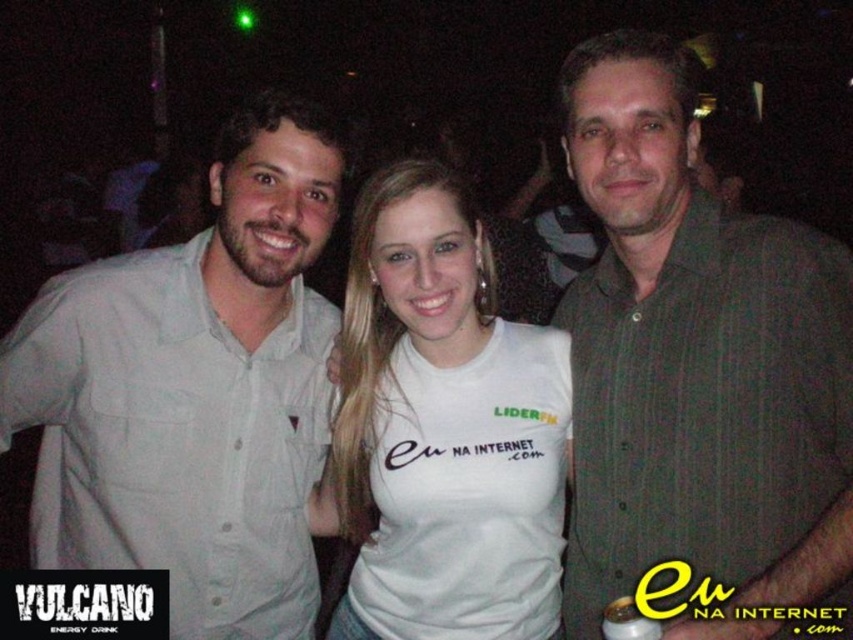
Can you confirm if dark green striped shirt at center is positioned below white cotton t-shirt at center?

Actually, dark green striped shirt at center is above white cotton t-shirt at center.

Does point (618, 589) come closer to viewer compared to point (480, 339)?

Yes, point (618, 589) is in front of point (480, 339).

Is point (685, 360) positioned before point (372, 412)?

Yes, it is.

Find the location of a particular element. This screenshot has width=853, height=640. dark green striped shirt at center is located at coordinates (695, 360).

Between dark green striped shirt at center and light gray button-up shirt at left, which one is positioned lower?

light gray button-up shirt at left

Between point (619, 465) and point (186, 508), which one is positioned in front?

Point (186, 508) is in front.

Describe the element at coordinates (695, 360) in the screenshot. I see `dark green striped shirt at center` at that location.

The image size is (853, 640). In order to click on dark green striped shirt at center in this screenshot , I will do click(695, 360).

Is light gray button-up shirt at left below white cotton t-shirt at center?

Actually, light gray button-up shirt at left is above white cotton t-shirt at center.

Looking at this image, is light gray button-up shirt at left shorter than white cotton t-shirt at center?

In fact, light gray button-up shirt at left may be taller than white cotton t-shirt at center.

Is point (248, 308) more distant than point (537, 497)?

Yes, point (248, 308) is behind point (537, 497).

Locate an element on the screen. light gray button-up shirt at left is located at coordinates (194, 390).